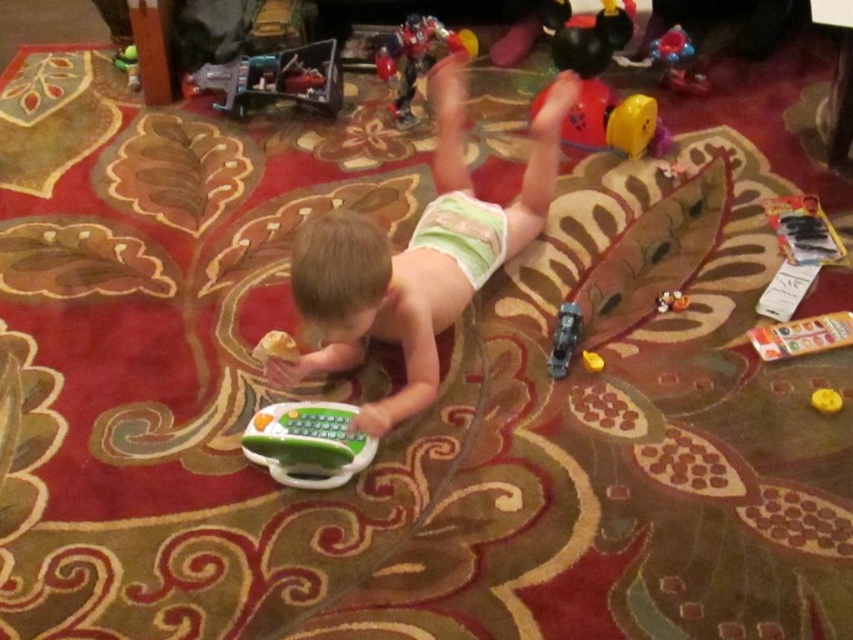
Question: Among these objects, which one is farthest from the camera?

Choices:
 (A) rubberized red and yellow toy at upper right
 (B) smooth plastic toy at center
 (C) matte plastic toy at lower right

Answer: (A)

Question: Does matte plastic toy at lower right come behind yellow matte toy at center?

Choices:
 (A) yes
 (B) no

Answer: (A)

Question: Considering the relative positions of metallic plastic toy at upper left and yellow matte toy at center in the image provided, where is metallic plastic toy at upper left located with respect to yellow matte toy at center?

Choices:
 (A) right
 (B) left

Answer: (B)

Question: Is green rubber toy at center thinner than yellow matte toy at center?

Choices:
 (A) no
 (B) yes

Answer: (A)

Question: Which of the following is the farthest from the observer?

Choices:
 (A) (456, 38)
 (B) (596, 369)
 (C) (213, 90)

Answer: (A)

Question: Estimate the real-world distances between objects in this image. Which object is closer to the metallic blue toy car at lower right?

Choices:
 (A) metallic red robot at upper center
 (B) matte plastic toy at lower right
 (C) smooth plastic toy at center
 (D) rubber duck at lower right

Answer: (D)